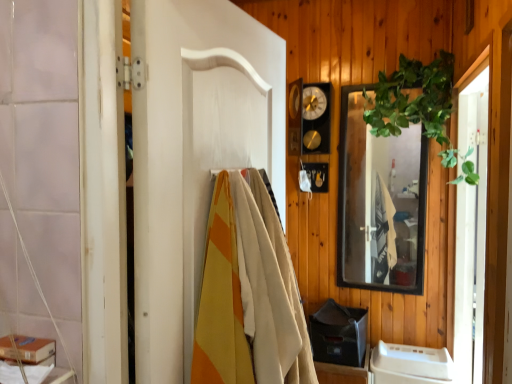
Question: Is transparent glass screen door at right positioned behind green leafy plant at upper right?

Choices:
 (A) no
 (B) yes

Answer: (A)

Question: Is transparent glass screen door at right closer to camera compared to green leafy plant at upper right?

Choices:
 (A) yes
 (B) no

Answer: (A)

Question: From a real-world perspective, is transparent glass screen door at right beneath green leafy plant at upper right?

Choices:
 (A) no
 (B) yes

Answer: (B)

Question: Is transparent glass screen door at right beside green leafy plant at upper right?

Choices:
 (A) no
 (B) yes

Answer: (A)

Question: Is transparent glass screen door at right taller than green leafy plant at upper right?

Choices:
 (A) no
 (B) yes

Answer: (B)

Question: Is transparent glass screen door at right facing towards green leafy plant at upper right?

Choices:
 (A) no
 (B) yes

Answer: (B)

Question: From a real-world perspective, is transparent glass screen door at right positioned under black glass mirror at upper right based on gravity?

Choices:
 (A) yes
 (B) no

Answer: (A)

Question: Is transparent glass screen door at right positioned far away from black glass mirror at upper right?

Choices:
 (A) no
 (B) yes

Answer: (A)

Question: Considering the relative positions of transparent glass screen door at right and black glass mirror at upper right in the image provided, is transparent glass screen door at right behind black glass mirror at upper right?

Choices:
 (A) yes
 (B) no

Answer: (B)

Question: Is transparent glass screen door at right beside black glass mirror at upper right?

Choices:
 (A) yes
 (B) no

Answer: (B)

Question: Does transparent glass screen door at right appear on the left side of black glass mirror at upper right?

Choices:
 (A) yes
 (B) no

Answer: (B)

Question: Is transparent glass screen door at right outside black glass mirror at upper right?

Choices:
 (A) no
 (B) yes

Answer: (B)

Question: Can you confirm if white plastic container at lower right is wider than black glass mirror at upper right?

Choices:
 (A) no
 (B) yes

Answer: (B)